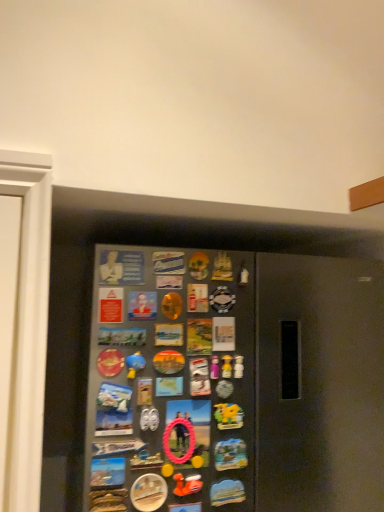
Question: From a real-world perspective, is metallic gray fridge at center above or below metallic blue magnet at lower left, placed as the fifth button when sorted from top to bottom?

Choices:
 (A) below
 (B) above

Answer: (B)

Question: Considering the positions of metallic gray fridge at center and metallic blue magnet at lower left, which ranks as the second button in bottom-to-top order, in the image, is metallic gray fridge at center taller or shorter than metallic blue magnet at lower left, which ranks as the second button in bottom-to-top order,?

Choices:
 (A) short
 (B) tall

Answer: (B)

Question: Based on their relative distances, which object is nearer to the pink rubber ring at center, positioned as the 4th button in bottom-to-top order?

Choices:
 (A) rubber duck at center
 (B) metallic button at center, the 5th button when ordered from bottom to top
 (C) matte plastic magnet at center, which appears as the 4th button when viewed from the top
 (D) rubber duck at lower center
 (E) metallic silver button at lower center, which ranks as the 1th button in bottom-to-top order

Answer: (C)

Question: Which object is the closest to the metallic button at center, acting as the 2th button starting from the top?

Choices:
 (A) matte plastic bust at upper center, positioned as the 6th button in bottom-to-top order
 (B) matte plastic magnet at center, which appears as the 4th button when viewed from the top
 (C) metallic silver button at lower center, which appears as the sixth button when viewed from the top
 (D) pink rubber ring at center, marked as the 3th button in a top-to-bottom arrangement
 (E) metallic gray fridge at center

Answer: (A)